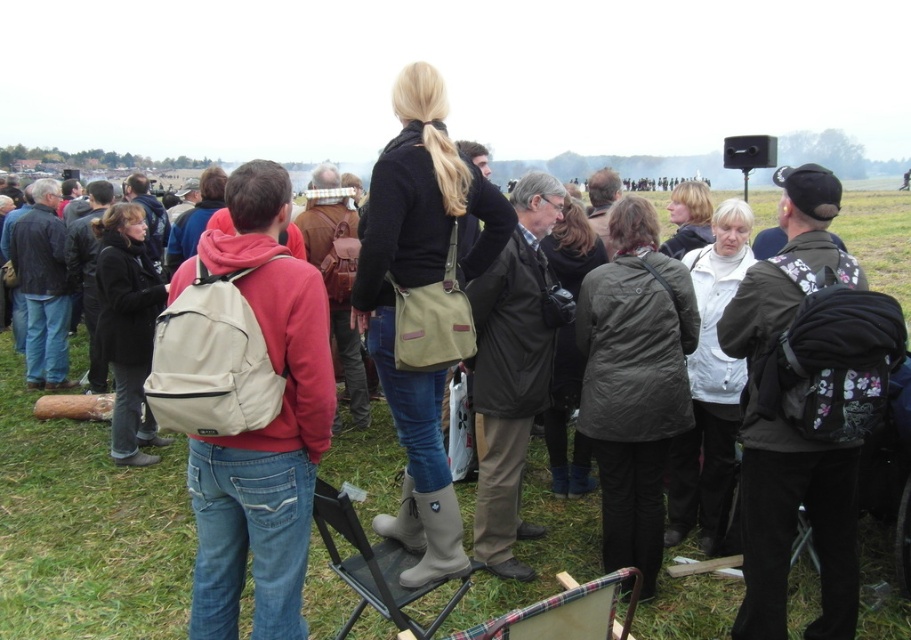
Which of these two, beige fabric backpack at center or dark green backpack at right, stands shorter?

dark green backpack at right is shorter.

Can you confirm if beige fabric backpack at center is positioned to the right of dark green backpack at right?

No, beige fabric backpack at center is not to the right of dark green backpack at right.

Is point (206, 611) positioned before point (861, 278)?

Yes, point (206, 611) is in front of point (861, 278).

You are a GUI agent. You are given a task and a screenshot of the screen. Output one action in this format:
    pyautogui.click(x=<x>, y=<y>)
    Task: Click on the beige fabric backpack at center
    The image size is (911, 640).
    Given the screenshot: What is the action you would take?
    pyautogui.click(x=263, y=422)

This screenshot has height=640, width=911. What do you see at coordinates (86, 529) in the screenshot?
I see `green grass at center` at bounding box center [86, 529].

Which of these two, green grass at center or beige fabric backpack at center, stands taller?

Standing taller between the two is beige fabric backpack at center.

Between point (311, 561) and point (256, 500), which one is positioned behind?

Point (311, 561)

Where is `green grass at center`? green grass at center is located at coordinates (86, 529).

Does dark green backpack at right appear over rubberized gray folding chair at center?

Indeed, dark green backpack at right is positioned over rubberized gray folding chair at center.

The width and height of the screenshot is (911, 640). In order to click on dark green backpack at right in this screenshot , I will do `click(786, 481)`.

You are a GUI agent. You are given a task and a screenshot of the screen. Output one action in this format:
    pyautogui.click(x=<x>, y=<y>)
    Task: Click on the dark green backpack at right
    This screenshot has height=640, width=911.
    Given the screenshot: What is the action you would take?
    pyautogui.click(x=786, y=481)